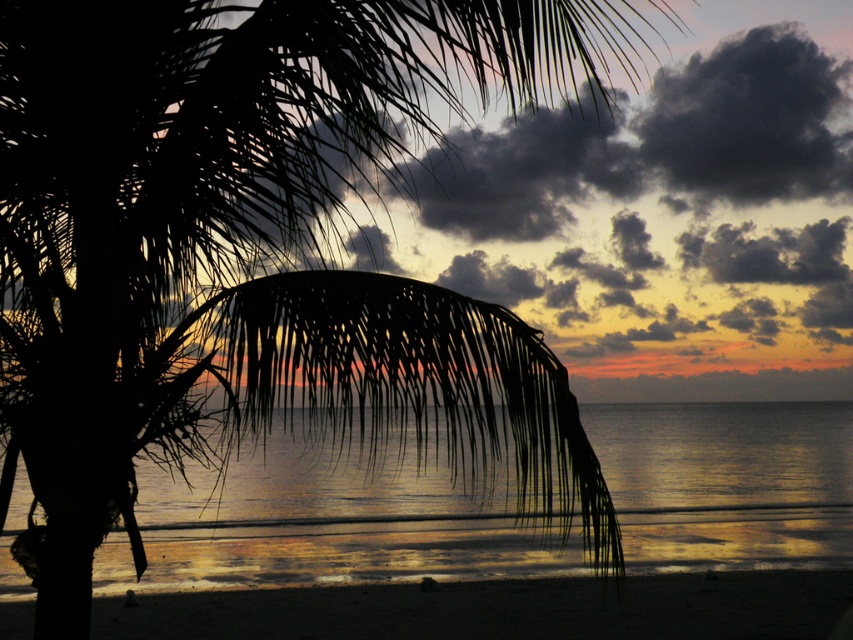
How far apart are glistening silver water at center and sandy beach at lower center?

glistening silver water at center is 2.01 meters from sandy beach at lower center.

Is point (355, 513) positioned in front of point (619, 612)?

No, (355, 513) is further to viewer.

In order to click on glistening silver water at center in this screenshot , I will do `click(727, 481)`.